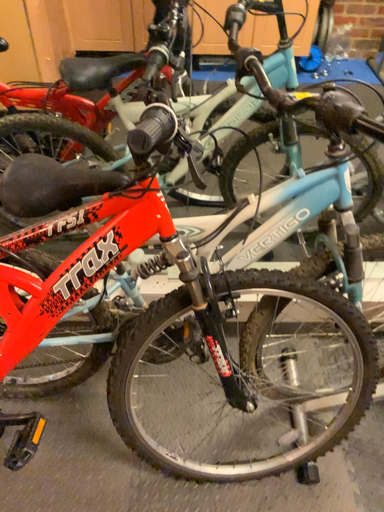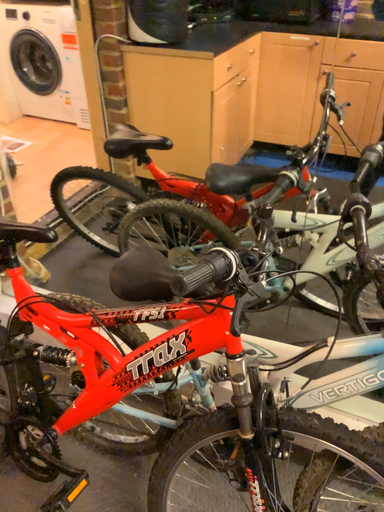
Question: How did the camera likely rotate when shooting the video?

Choices:
 (A) rotated left
 (B) rotated right

Answer: (A)